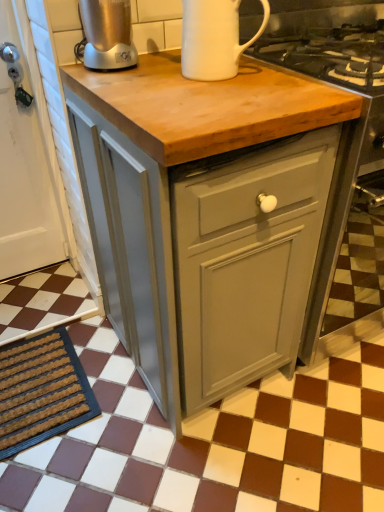
Image resolution: width=384 pixels, height=512 pixels. I want to click on free spot in front of white ceramic mug at upper center, the first kitchen appliance from the right, so click(210, 89).